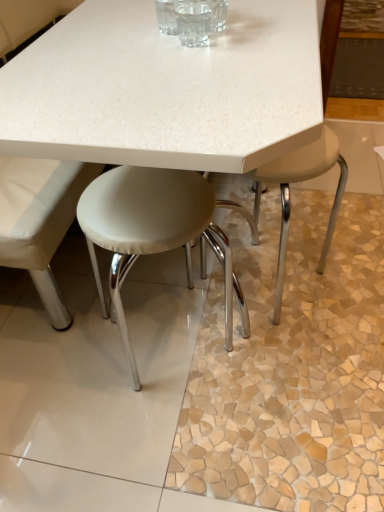
Locate an element on the screen. This screenshot has width=384, height=512. free location above white leather stool at center, which is the 1th stool in left-to-right order (from a real-world perspective) is located at coordinates 146,198.